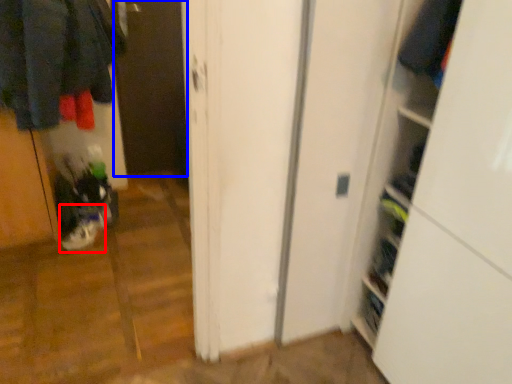
Question: Which object appears closest to the camera in this image, footwear (highlighted by a red box) or screen door (highlighted by a blue box)?

Choices:
 (A) footwear
 (B) screen door

Answer: (A)